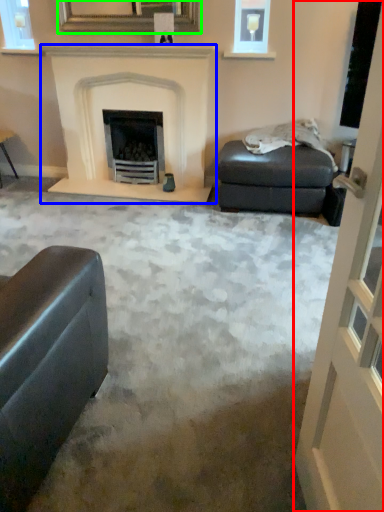
Question: Which object is the closest to the screen door (highlighted by a red box)? Choose among these: fireplace (highlighted by a blue box) or picture frame (highlighted by a green box).

Choices:
 (A) fireplace
 (B) picture frame

Answer: (A)